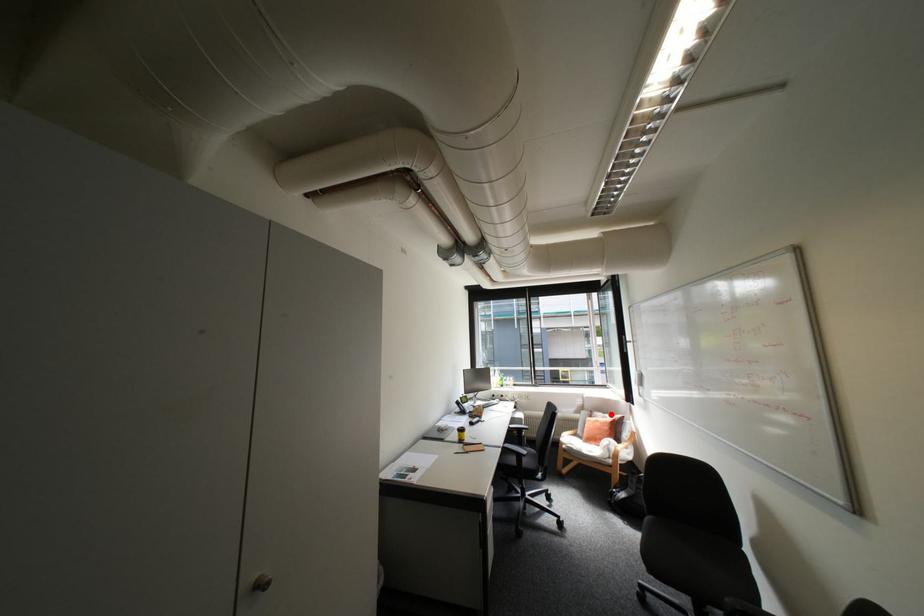
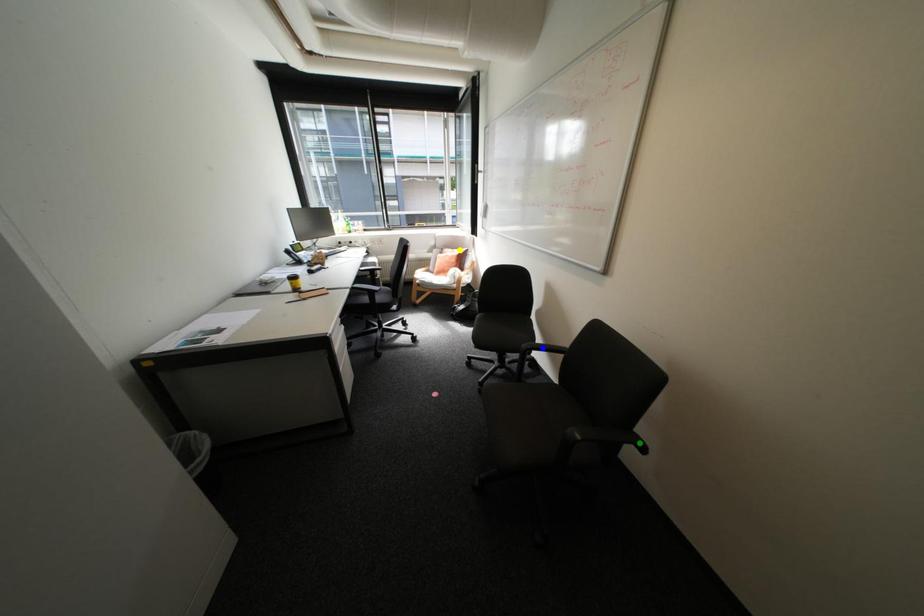
Question: I am providing you with two images of the same scene from different viewpoints. A red point is marked on the first image. You are given multiple points on the second image. Which point in image 2 is actually the same real-world point as the red point in image 1?

Choices:
 (A) green point
 (B) yellow point
 (C) blue point

Answer: (B)